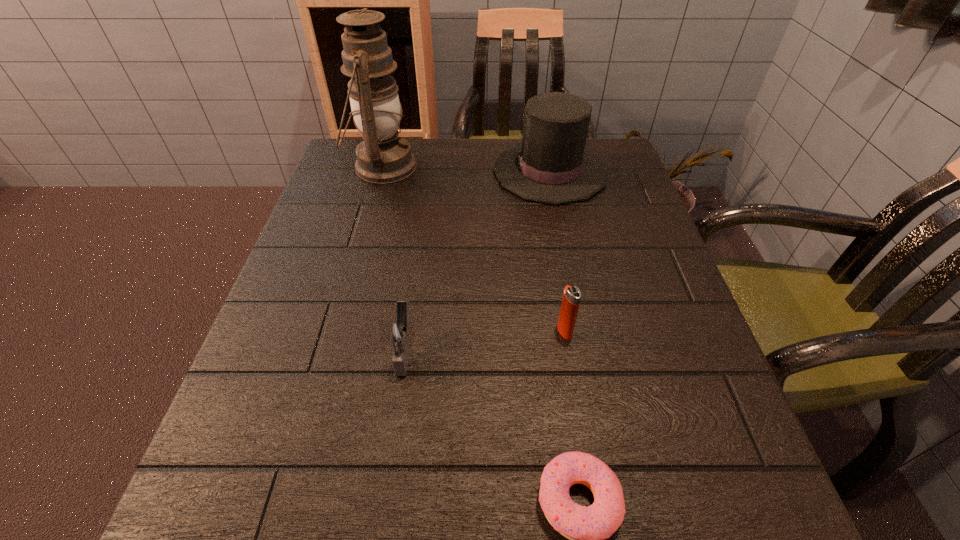
This screenshot has width=960, height=540. Find the location of `oil lamp`. oil lamp is located at coordinates (383, 157).

Identify the location of the tallest object. (383, 157).

What are the coordinates of `dress hat` in the screenshot? It's located at (551, 165).

Find the location of a particular element. the fourth object from right to left is located at coordinates (400, 333).

The image size is (960, 540). I want to click on the right igniter, so click(x=572, y=296).

Locate an element on the screen. This screenshot has height=540, width=960. blank area located on the right of the oil lamp is located at coordinates (470, 167).

The height and width of the screenshot is (540, 960). I want to click on free region located on the front of the fourth shortest object with the decoration, so click(x=443, y=172).

The width and height of the screenshot is (960, 540). In order to click on vacant space located 0.230m on the front of the fourth shortest object with the decoration in this screenshot , I will do `click(403, 172)`.

Locate an element on the screen. This screenshot has width=960, height=540. free location located 0.200m on the front of the fourth shortest object with the decoration is located at coordinates pos(415,172).

Find the location of a particular element. The height and width of the screenshot is (540, 960). blank space located on the right of the left igniter is located at coordinates (593, 350).